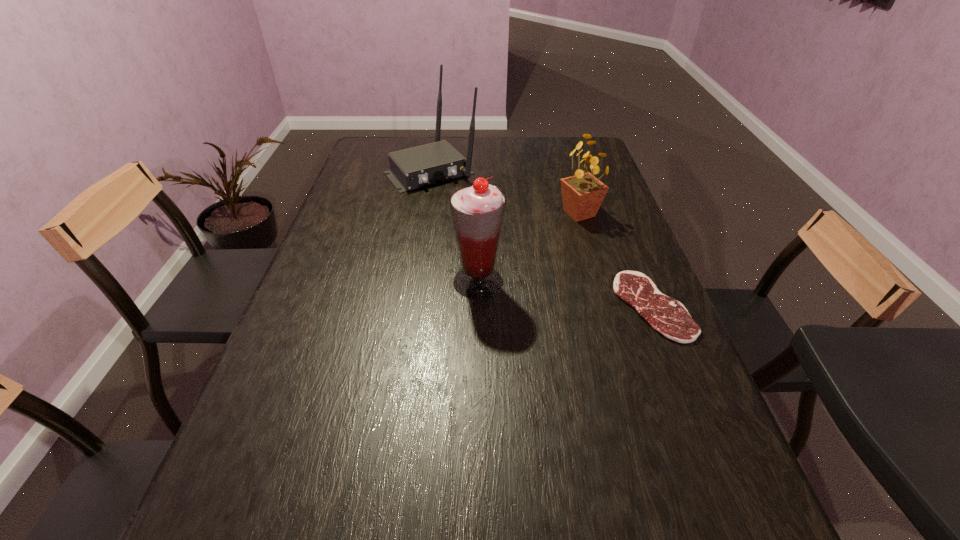
Identify the location of vacant space at the left edge of the desktop. Image resolution: width=960 pixels, height=540 pixels. (300, 309).

This screenshot has width=960, height=540. I want to click on vacant space at the right edge, so click(634, 349).

At what (x,y) coordinates should I click in order to perform the action: click on vacant space at the far left corner of the desktop. Please return your answer as a coordinate pair (x, y). Looking at the image, I should click on (405, 148).

You are a GUI agent. You are given a task and a screenshot of the screen. Output one action in this format:
    pyautogui.click(x=<x>, y=<y>)
    Task: Click on the vacant region at the near left corner of the desktop
    The width and height of the screenshot is (960, 540).
    Given the screenshot: What is the action you would take?
    pyautogui.click(x=274, y=455)

Locate an element on the screen. This screenshot has height=540, width=960. free space at the near right corner of the desktop is located at coordinates (674, 473).

Identify the location of free area in between the farthest object and the steak. (541, 239).

The width and height of the screenshot is (960, 540). I want to click on vacant space that's between the third nearest object and the farthest object, so click(505, 192).

The height and width of the screenshot is (540, 960). Find the location of `vacant area between the second shortest object and the steak`. vacant area between the second shortest object and the steak is located at coordinates (615, 260).

You are a GUI agent. You are given a task and a screenshot of the screen. Output one action in this format:
    pyautogui.click(x=<x>, y=<y>)
    Task: Click on the free spot between the steak and the router
    Image resolution: width=960 pixels, height=540 pixels.
    Given the screenshot: What is the action you would take?
    pyautogui.click(x=541, y=239)

The height and width of the screenshot is (540, 960). In order to click on free space between the steak and the farthest object in this screenshot , I will do `click(541, 239)`.